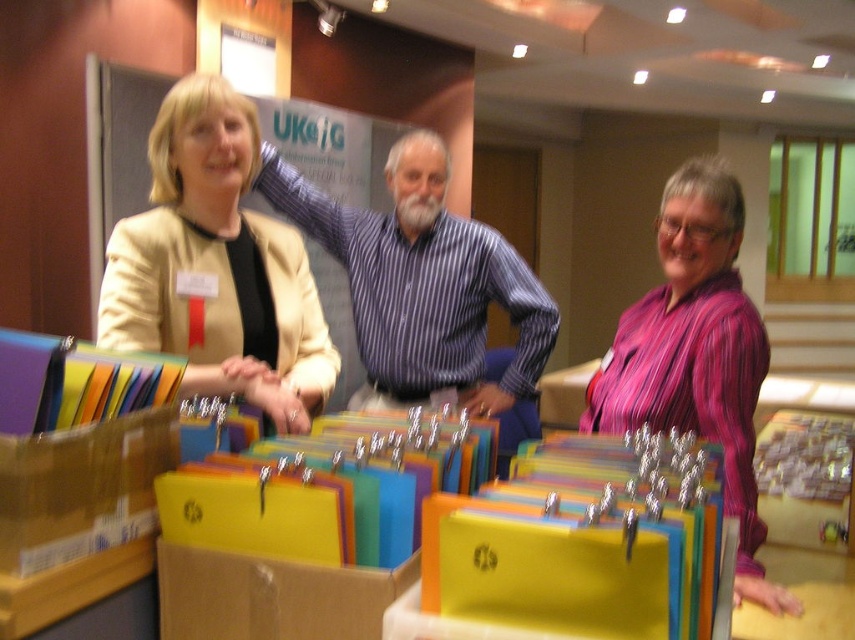
You are an event photographer who needs to capture a clear photo of both the matte black jacket at center and the purple striped shirt at center. However, you notice one is covering part of the other. Which clothing item is currently blocking the view of the other?

The matte black jacket at center is positioned over the purple striped shirt at center, so it is blocking the view of the purple striped shirt at center.

You are standing in the conference room and want to determine which of the two points, point (249, 256) or point (473, 237), is closer to you. Based on the scene, which point is nearer?

Point (249, 256) is closer to the camera than point (473, 237), so it is nearer to you.

You are standing at the origin point of the coordinate system in the image. The image has a coordinate system where the bottom left corner is the origin point. The coordinates are given in normalized values between 0 and 1. You want to move towards the matte black jacket at center. What direction should you move in?

Since the matte black jacket at center is located at coordinates point (694, 352), which is to the right and above the origin point, you should move northeast to reach it.